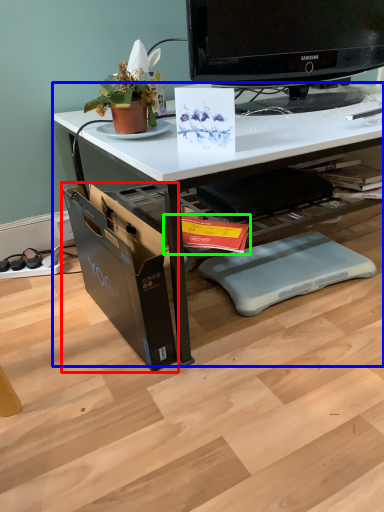
Question: Based on their relative distances, which object is nearer to file cabinet (highlighted by a red box)? Choose from desk (highlighted by a blue box) and magazine (highlighted by a green box).

Choices:
 (A) desk
 (B) magazine

Answer: (B)